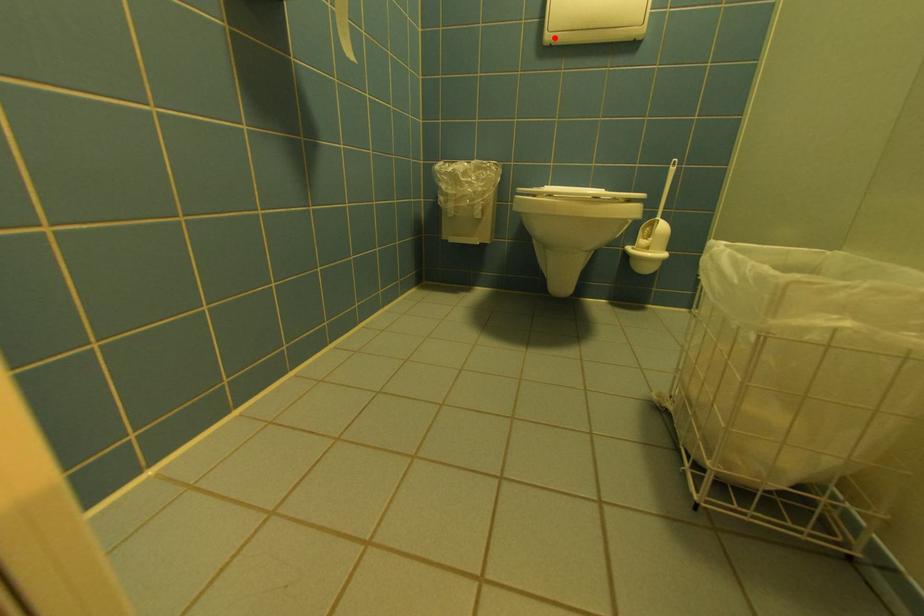
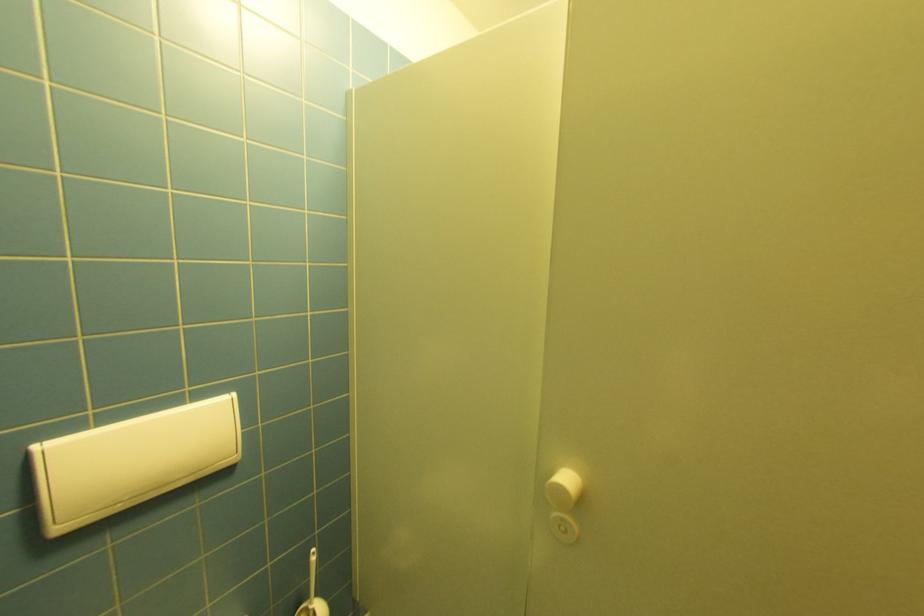
Question: I am providing you with two images of the same scene from different viewpoints. Image1 has a red point marked. In image2, the corresponding 3D location appears at what relative position? Reply with the corresponding letter.

Choices:
 (A) Closer
 (B) Farther

Answer: (A)